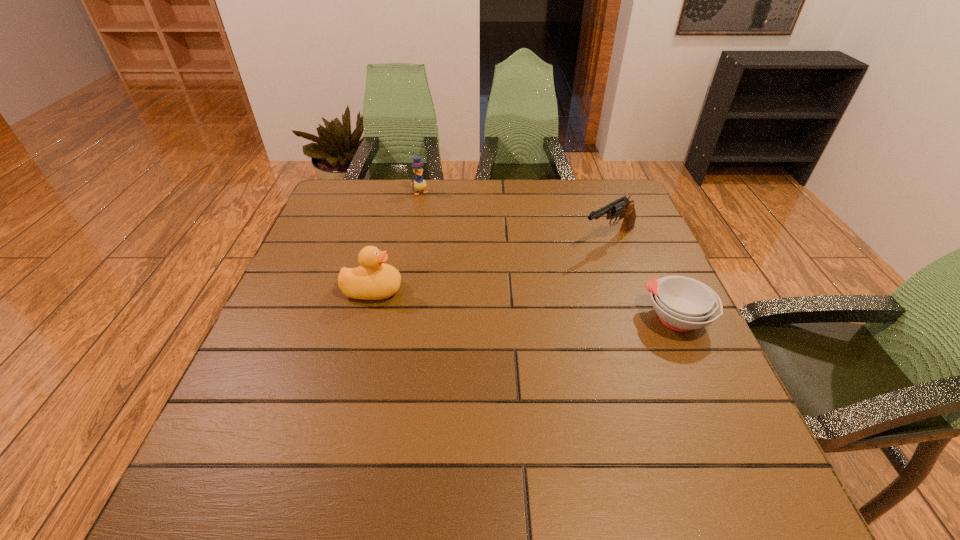
The height and width of the screenshot is (540, 960). I want to click on duck, so click(374, 280).

Locate an element on the screen. soup bowl is located at coordinates pos(682,303).

Locate an element on the screen. the second farthest object is located at coordinates (622, 206).

Find the location of a particular element. Image resolution: width=960 pixels, height=540 pixels. the farthest object is located at coordinates (419, 184).

I want to click on vacant space located 0.240m on the face of the duck, so click(501, 290).

Find the location of a particular element. This screenshot has height=540, width=960. vacant space located on the left of the shortest object is located at coordinates (556, 319).

Where is `vacant space positioned along the barrel of the gun`? vacant space positioned along the barrel of the gun is located at coordinates (501, 298).

Locate an element on the screen. The height and width of the screenshot is (540, 960). vacant space located 0.150m along the barrel of the gun is located at coordinates (547, 272).

You are a GUI agent. You are given a task and a screenshot of the screen. Output one action in this format:
    pyautogui.click(x=<x>, y=<y>)
    Task: Click on the blank space located 0.160m along the barrel of the gun
    The width and height of the screenshot is (960, 540).
    Given the screenshot: What is the action you would take?
    pyautogui.click(x=544, y=273)

The image size is (960, 540). Identify the location of free spot located on the face of the farthest object, where the monocle is placed. (443, 227).